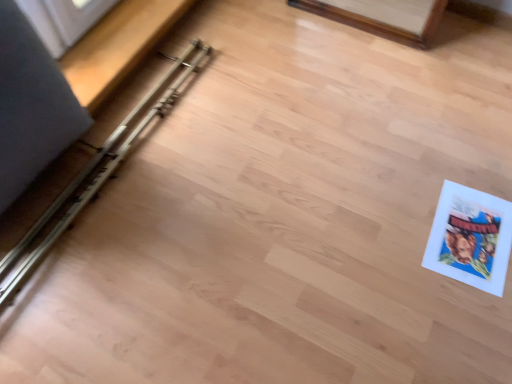
Locate an element on the screen. The height and width of the screenshot is (384, 512). vacant space in front of metallic silver rail at left is located at coordinates (140, 271).